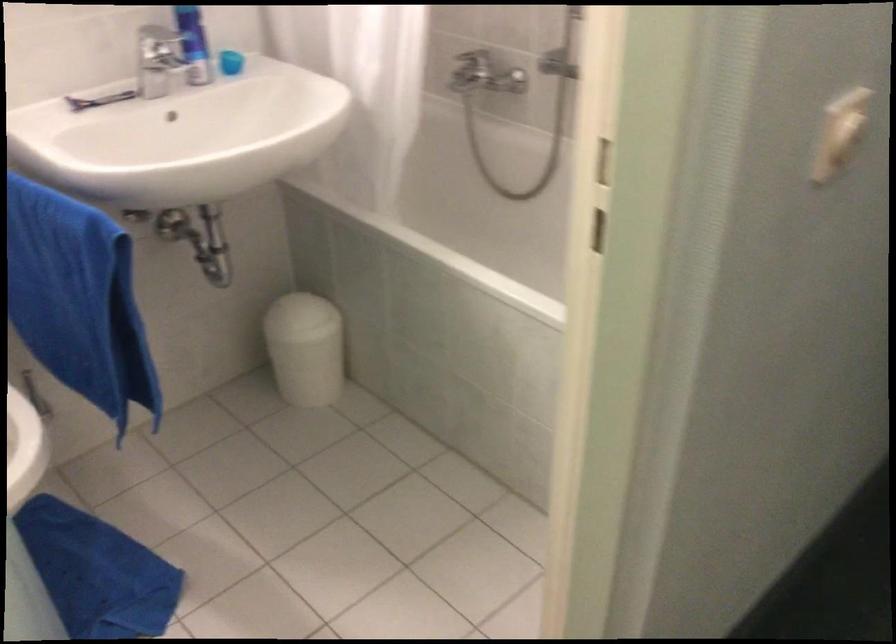
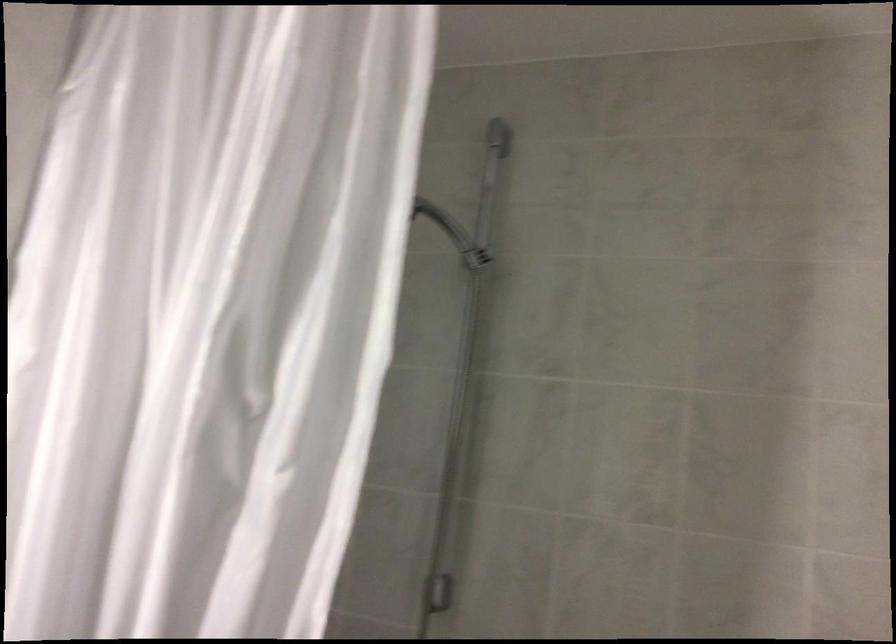
The first image is from the beginning of the video and the second image is from the end. How did the camera likely rotate when shooting the video?

The rotation direction of the camera is right-up.